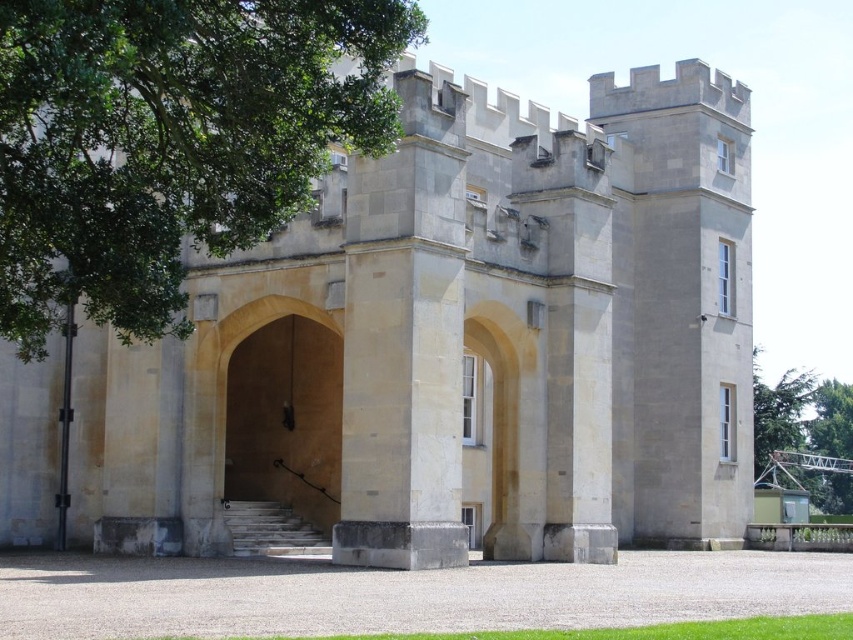
Question: Does beige stone archway at center come behind green leafy tree at right?

Choices:
 (A) no
 (B) yes

Answer: (A)

Question: Which point appears farthest from the camera in this image?

Choices:
 (A) (788, 440)
 (B) (281, 433)
 (C) (840, 502)

Answer: (C)

Question: Is green leafy tree at upper left further to camera compared to green leafy tree at right?

Choices:
 (A) yes
 (B) no

Answer: (B)

Question: Which object is farther from the camera taking this photo?

Choices:
 (A) beige stone archway at center
 (B) beige stone gate at center

Answer: (A)

Question: Is green leafy tree at upper left below green leafy tree at right?

Choices:
 (A) yes
 (B) no

Answer: (B)

Question: Which point appears closest to the camera in this image?

Choices:
 (A) (12, 465)
 (B) (799, 440)
 (C) (3, 262)
 (D) (254, 488)

Answer: (C)